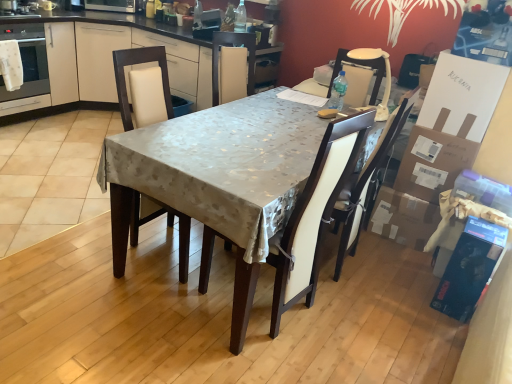
Question: Does satin silver microwave at upper center have a lesser height compared to cardboard box at right, which appears as the second cardboard box when ordered from the bottom?

Choices:
 (A) no
 (B) yes

Answer: (B)

Question: Is satin silver microwave at upper center in front of cardboard box at right, which is counted as the first cardboard box, starting from the top?

Choices:
 (A) no
 (B) yes

Answer: (A)

Question: Considering the relative sizes of satin silver microwave at upper center and cardboard box at right, which is counted as the first cardboard box, starting from the top, in the image provided, is satin silver microwave at upper center wider than cardboard box at right, which is counted as the first cardboard box, starting from the top,?

Choices:
 (A) yes
 (B) no

Answer: (A)

Question: From a real-world perspective, is satin silver microwave at upper center over cardboard box at right, which is counted as the first cardboard box, starting from the top?

Choices:
 (A) no
 (B) yes

Answer: (B)

Question: Is satin silver microwave at upper center far from cardboard box at right, which appears as the second cardboard box when ordered from the bottom?

Choices:
 (A) no
 (B) yes

Answer: (B)

Question: Is satin silver microwave at upper center facing towards cardboard box at right, which is counted as the first cardboard box, starting from the top?

Choices:
 (A) no
 (B) yes

Answer: (B)

Question: Is matte white oven at left not close to satin silver microwave at upper center?

Choices:
 (A) no
 (B) yes

Answer: (A)

Question: Is satin silver microwave at upper center located within matte white oven at left?

Choices:
 (A) yes
 (B) no

Answer: (B)

Question: Does matte white oven at left turn towards satin silver microwave at upper center?

Choices:
 (A) no
 (B) yes

Answer: (A)

Question: Considering the relative sizes of matte white oven at left and satin silver microwave at upper center in the image provided, is matte white oven at left bigger than satin silver microwave at upper center?

Choices:
 (A) yes
 (B) no

Answer: (A)

Question: Does matte white oven at left come behind satin silver microwave at upper center?

Choices:
 (A) no
 (B) yes

Answer: (A)

Question: From a real-world perspective, is matte white oven at left located beneath satin silver microwave at upper center?

Choices:
 (A) no
 (B) yes

Answer: (B)

Question: Does cardboard box at right, which appears as the second cardboard box when ordered from the bottom, have a greater width compared to beige fabric chair at upper right, the 3th chair positioned from the left?

Choices:
 (A) no
 (B) yes

Answer: (B)